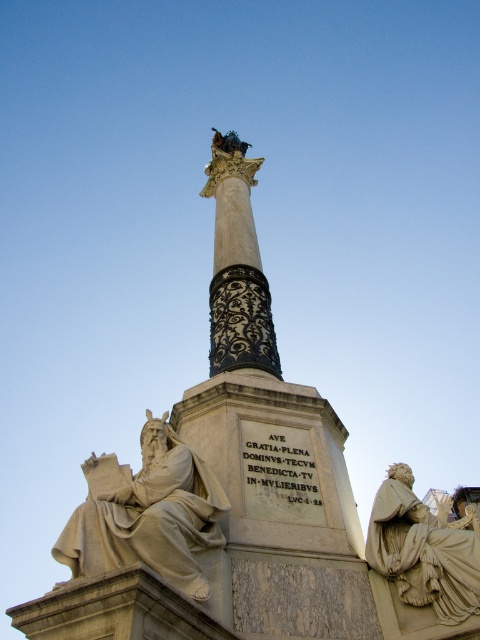
Question: Estimate the real-world distances between objects in this image. Which object is farther from the white marble statue at lower left?

Choices:
 (A) beige stone statue at lower right
 (B) black marble column at center

Answer: (B)

Question: Can you confirm if beige stone statue at lower right is smaller than black marble column at center?

Choices:
 (A) no
 (B) yes

Answer: (A)

Question: Does beige stone statue at lower right have a greater width compared to black marble column at center?

Choices:
 (A) no
 (B) yes

Answer: (B)

Question: Estimate the real-world distances between objects in this image. Which object is farther from the black marble column at center?

Choices:
 (A) beige stone statue at lower right
 (B) white marble statue at lower left

Answer: (A)

Question: Considering the real-world distances, which object is farthest from the white marble statue at lower left?

Choices:
 (A) black marble column at center
 (B) beige stone statue at lower right

Answer: (A)

Question: In this image, where is beige stone statue at lower right located relative to black marble column at center?

Choices:
 (A) above
 (B) below

Answer: (B)